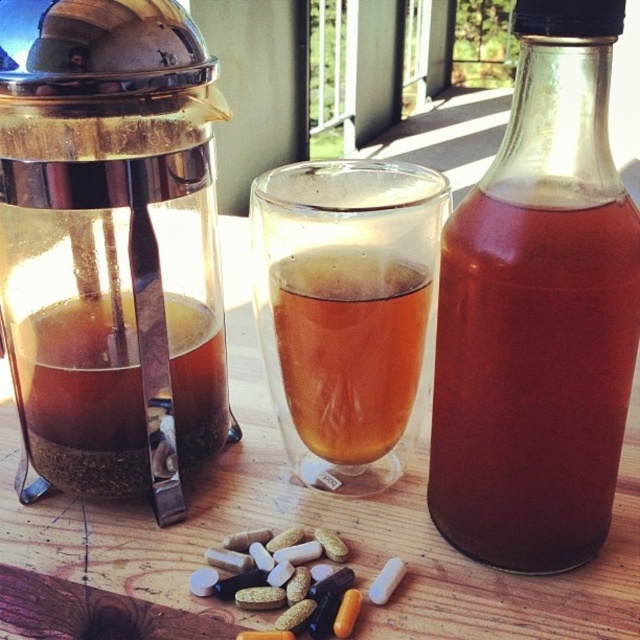
Can you confirm if translucent glass bottle at center is positioned to the right of translucent glass tea at left?

Yes, translucent glass bottle at center is to the right of translucent glass tea at left.

Between point (440, 296) and point (51, 385), which one is positioned behind?

The point (51, 385) is more distant.

The height and width of the screenshot is (640, 640). Describe the element at coordinates (538, 310) in the screenshot. I see `translucent glass bottle at center` at that location.

Image resolution: width=640 pixels, height=640 pixels. Identify the location of translucent glass bottle at center. (538, 310).

In the scene shown: Can you confirm if translucent glass bottle at center is positioned to the left of translucent glass cup at center?

Incorrect, translucent glass bottle at center is not on the left side of translucent glass cup at center.

Is translucent glass bottle at center smaller than translucent glass cup at center?

No, translucent glass bottle at center is not smaller than translucent glass cup at center.

Is point (595, 516) positioned after point (332, 342)?

No, (595, 516) is closer to viewer.

I want to click on translucent glass bottle at center, so click(x=538, y=310).

Who is more distant from viewer, (x=195, y=147) or (x=364, y=424)?

Positioned behind is point (x=364, y=424).

Between transparent glass coffee maker at left and translucent glass cup at center, which one appears on the left side from the viewer's perspective?

From the viewer's perspective, transparent glass coffee maker at left appears more on the left side.

What do you see at coordinates (109, 246) in the screenshot? I see `transparent glass coffee maker at left` at bounding box center [109, 246].

What are the coordinates of `transparent glass coffee maker at left` in the screenshot? It's located at (109, 246).